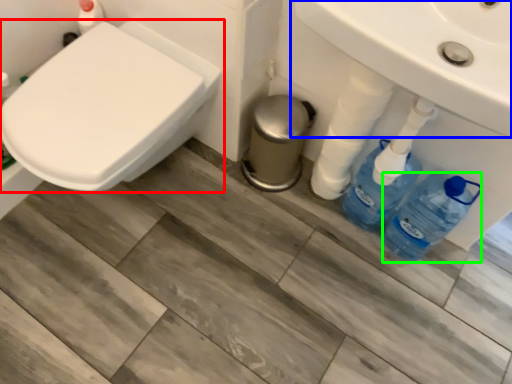
Question: Considering the real-world distances, which object is closest to toilet (highlighted by a red box)? sink (highlighted by a blue box) or bottle (highlighted by a green box).

Choices:
 (A) sink
 (B) bottle

Answer: (A)